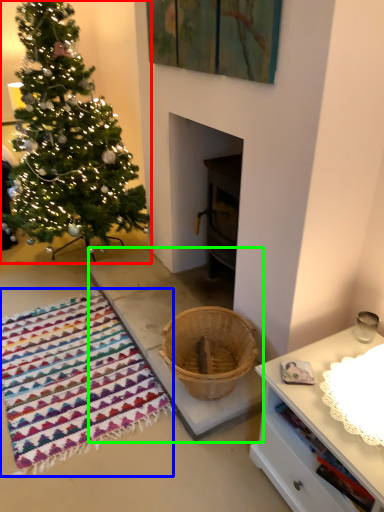
Question: Estimate the real-world distances between objects in this image. Which object is farther from christmas tree (highlighted by a red box), blanket (highlighted by a blue box) or concrete (highlighted by a green box)?

Choices:
 (A) blanket
 (B) concrete

Answer: (A)